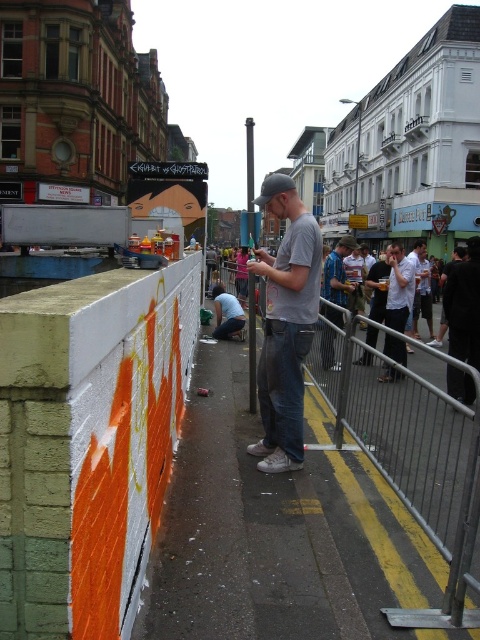
You are a photographer standing in the urban street scene described. You want to take a photo that includes both the graffiti wall on the left and the man near the metal barricade. Which of the two points, point (x=289, y=417) or point (x=455, y=374), is closer to your camera position?

Point (x=289, y=417) is closer to the camera than point (x=455, y=374).